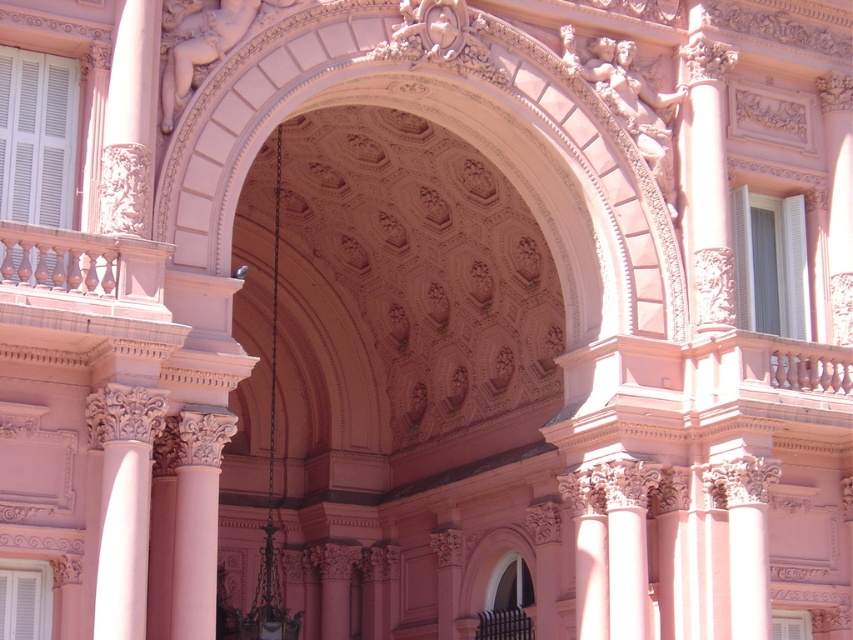
Which is below, white carved column at center or pink marble column at center?

pink marble column at center is lower down.

Is white carved column at center to the right of pink marble column at center from the viewer's perspective?

No, white carved column at center is not to the right of pink marble column at center.

Locate an element on the screen. white carved column at center is located at coordinates (123, 502).

Which of these two, pink marble column at center or smooth pink column at center, stands taller?

Standing taller between the two is smooth pink column at center.

Between pink marble column at center and smooth pink column at center, which one appears on the right side from the viewer's perspective?

Positioned to the right is smooth pink column at center.

At what (x,y) coordinates should I click in order to perform the action: click on pink marble column at center. Please return your answer as a coordinate pair (x, y). Looking at the image, I should click on (196, 522).

This screenshot has height=640, width=853. Find the location of `pink marble column at center`. pink marble column at center is located at coordinates (196, 522).

Which is in front, point (109, 324) or point (146, 433)?

Positioned in front is point (109, 324).

From the picture: Between smooth pink railing at left and white carved column at center, which one appears on the right side from the viewer's perspective?

From the viewer's perspective, white carved column at center appears more on the right side.

You are a GUI agent. You are given a task and a screenshot of the screen. Output one action in this format:
    pyautogui.click(x=<x>, y=<y>)
    Task: Click on the smooth pink railing at left
    
    Given the screenshot: What is the action you would take?
    pyautogui.click(x=84, y=292)